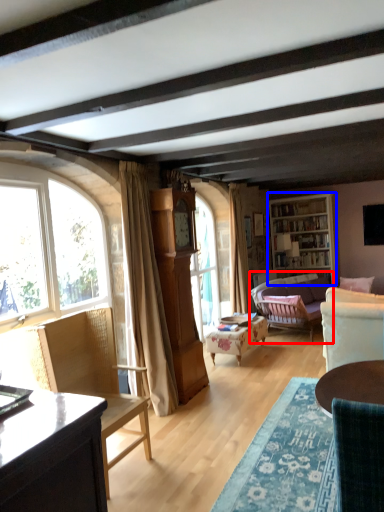
Question: Among these objects, which one is nearest to the camera, studio couch (highlighted by a red box) or cabinetry (highlighted by a blue box)?

Choices:
 (A) studio couch
 (B) cabinetry

Answer: (A)